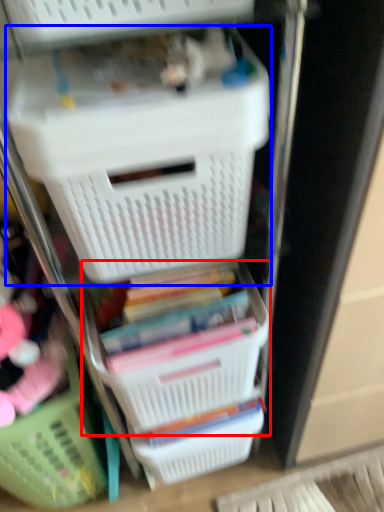
Question: Which point is closer to the camera, basket (highlighted by a red box) or storage box (highlighted by a blue box)?

Choices:
 (A) basket
 (B) storage box

Answer: (B)